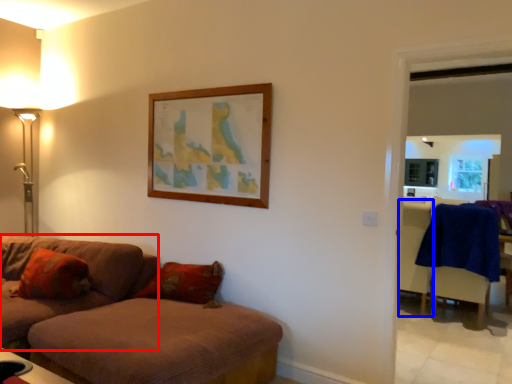
Question: Which object is further to the camera taking this photo, studio couch (highlighted by a red box) or armchair (highlighted by a blue box)?

Choices:
 (A) studio couch
 (B) armchair

Answer: (B)